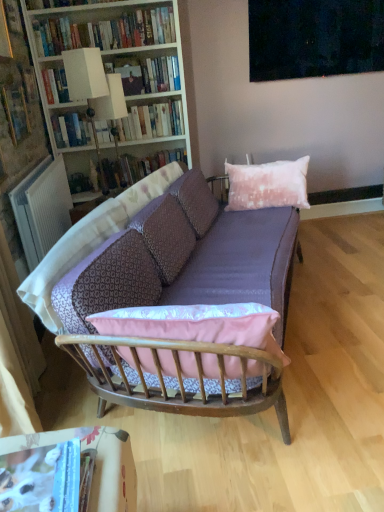
The height and width of the screenshot is (512, 384). I want to click on dark matte painting at upper center, so click(x=314, y=38).

Image resolution: width=384 pixels, height=512 pixels. What do you see at coordinates (94, 92) in the screenshot? I see `white fabric lampshade at upper left, arranged as the 1th lamp when viewed from the front` at bounding box center [94, 92].

This screenshot has width=384, height=512. Describe the element at coordinates (161, 74) in the screenshot. I see `hardcover book at upper center, the 2th book in the top-to-bottom sequence` at that location.

I want to click on white wood bookcase at upper left, so (107, 76).

In order to click on hardcover books at upper left, the third book from the top in this screenshot , I will do `click(146, 122)`.

Relative to white fabric lampshade at upper left, arranged as the 1th lamp when viewed from the front, is hardcover books at upper left, the third book from the top, in front or behind?

hardcover books at upper left, the third book from the top, is positioned farther from the viewer than white fabric lampshade at upper left, arranged as the 1th lamp when viewed from the front.

From the image's perspective, would you say hardcover books at upper left, the fourth book ordered from the bottom, is shown under white fabric lampshade at upper left, arranged as the 1th lamp when viewed from the front?

Actually, hardcover books at upper left, the fourth book ordered from the bottom, appears above white fabric lampshade at upper left, arranged as the 1th lamp when viewed from the front, in the image.

Is hardcover books at upper left, the third book from the top, oriented towards white fabric lampshade at upper left, the second lamp when ordered from back to front?

Yes, hardcover books at upper left, the third book from the top, is facing white fabric lampshade at upper left, the second lamp when ordered from back to front.

Which of these two, hardcover books at upper left, which ranks as the fifth book in front-to-back order, or white fabric lampshade at upper left, the second lamp when ordered from back to front, is smaller?

white fabric lampshade at upper left, the second lamp when ordered from back to front.

Can you confirm if white fabric lampshade at upper left, which is the 1th lamp from back to front, is taller than dark matte painting at upper center?

Indeed, white fabric lampshade at upper left, which is the 1th lamp from back to front, has a greater height compared to dark matte painting at upper center.

Are white fabric lampshade at upper left, which is the 1th lamp from back to front, and dark matte painting at upper center making contact?

No, white fabric lampshade at upper left, which is the 1th lamp from back to front, is not in contact with dark matte painting at upper center.

Is white fabric lampshade at upper left, which is the 1th lamp from back to front, at the right side of dark matte painting at upper center?

No, white fabric lampshade at upper left, which is the 1th lamp from back to front, is not to the right of dark matte painting at upper center.

Does white fabric lampshade at upper left, which is the 1th lamp from back to front, have a larger size compared to dark matte painting at upper center?

No.

Is hardcover books at upper left, arranged as the 6th book when ordered from the bottom, beside white fabric lampshade at upper left, the second lamp when ordered from back to front?

No.

Which of these two, hardcover books at upper left, arranged as the 4th book when viewed from the back, or white fabric lampshade at upper left, arranged as the 1th lamp when viewed from the front, is bigger?

hardcover books at upper left, arranged as the 4th book when viewed from the back.

Considering the sizes of objects hardcover books at upper left, arranged as the 6th book when ordered from the bottom, and white fabric lampshade at upper left, arranged as the 1th lamp when viewed from the front, in the image provided, who is shorter, hardcover books at upper left, arranged as the 6th book when ordered from the bottom, or white fabric lampshade at upper left, arranged as the 1th lamp when viewed from the front,?

Standing shorter between the two is hardcover books at upper left, arranged as the 6th book when ordered from the bottom.

From a real-world perspective, is hardcover books at upper left, arranged as the third book when viewed from the front, positioned above or below white fabric lampshade at upper left, arranged as the 1th lamp when viewed from the front?

hardcover books at upper left, arranged as the third book when viewed from the front, is above white fabric lampshade at upper left, arranged as the 1th lamp when viewed from the front.

Is purple fabric couch at center oriented away from white paper book at lower left, acting as the 1th book starting from the bottom?

No, white paper book at lower left, acting as the 1th book starting from the bottom, is not at the back of purple fabric couch at center.

Which object is closer to the camera taking this photo, purple fabric couch at center or white paper book at lower left, acting as the 1th book starting from the bottom?

white paper book at lower left, acting as the 1th book starting from the bottom, is in front.

Would you say purple fabric couch at center is to the left or to the right of white paper book at lower left, acting as the 1th book starting from the bottom, in the picture?

purple fabric couch at center is to the right of white paper book at lower left, acting as the 1th book starting from the bottom.

From the image's perspective, which one is positioned lower, purple fabric couch at center or white paper book at lower left, the 1th book from the front?

white paper book at lower left, the 1th book from the front, is shown below in the image.

Can you confirm if purple fabric couch at center is wider than hardcover book at center, the sixth book positioned from the front?

Yes.

Is purple fabric couch at center positioned beyond the bounds of hardcover book at center, which is the second book in bottom-to-top order?

Yes, purple fabric couch at center is outside of hardcover book at center, which is the second book in bottom-to-top order.

Between purple fabric couch at center and hardcover book at center, positioned as the fifth book in top-to-bottom order, which one has more height?

purple fabric couch at center is taller.

From the image's perspective, is dark matte painting at upper center positioned above or below hardcover book at upper left, acting as the fifth book starting from the back?

dark matte painting at upper center is situated higher than hardcover book at upper left, acting as the fifth book starting from the back, in the image.

Based on the photo, considering their positions, is dark matte painting at upper center located in front of or behind hardcover book at upper left, which ranks as the third book in bottom-to-top order?

dark matte painting at upper center is behind hardcover book at upper left, which ranks as the third book in bottom-to-top order.

Is dark matte painting at upper center taller than hardcover book at upper left, the second book when ordered from front to back?

Correct, dark matte painting at upper center is much taller as hardcover book at upper left, the second book when ordered from front to back.

From the image's perspective, between white paper book at lower left, acting as the 6th book starting from the top, and dark matte painting at upper center, which one is located above?

dark matte painting at upper center.

From a real-world perspective, is white paper book at lower left, the 1th book from the front, over dark matte painting at upper center?

No.

Between white paper book at lower left, the 1th book from the front, and dark matte painting at upper center, which one is positioned behind?

dark matte painting at upper center is more distant.

Is white paper book at lower left, acting as the 1th book starting from the bottom, spatially inside dark matte painting at upper center, or outside of it?

white paper book at lower left, acting as the 1th book starting from the bottom, cannot be found inside dark matte painting at upper center.

Where is `lamp that is the 1st object to the right of the hardcover books at upper left, the 2th book from the back, starting at the anchor`? Image resolution: width=384 pixels, height=512 pixels. lamp that is the 1st object to the right of the hardcover books at upper left, the 2th book from the back, starting at the anchor is located at coordinates (94, 92).

Where is `the 1st lamp to the left when counting from the dark matte painting at upper center`? The image size is (384, 512). the 1st lamp to the left when counting from the dark matte painting at upper center is located at coordinates (106, 114).

Which object lies further to the anchor point white wood bookcase at upper left, purple fabric couch at center or white fabric lampshade at upper left, the second lamp positioned from the front?

purple fabric couch at center is positioned further to the anchor white wood bookcase at upper left.

From the image, which object appears to be nearer to hardcover books at upper left, which ranks as the fifth book in front-to-back order, hardcover book at upper left, which ranks as the third book in bottom-to-top order, or white fabric lampshade at upper left, the second lamp when ordered from back to front?

white fabric lampshade at upper left, the second lamp when ordered from back to front, lies closer to hardcover books at upper left, which ranks as the fifth book in front-to-back order, than the other object.

In the scene shown: From the image, which object appears to be nearer to white wood bookcase at upper left, purple fabric couch at center or hardcover book at center, which is the second book in bottom-to-top order?

hardcover book at center, which is the second book in bottom-to-top order, lies closer to white wood bookcase at upper left than the other object.

Which object lies nearer to the anchor point pink cotton pillow at upper right, white fabric lampshade at upper left, arranged as the 1th lamp when viewed from the front, or white plastic radiator at left?

white fabric lampshade at upper left, arranged as the 1th lamp when viewed from the front, is positioned closer to the anchor pink cotton pillow at upper right.

From the image, which object appears to be nearer to dark matte painting at upper center, hardcover books at upper left, arranged as the 4th book when viewed from the back, or white fabric lampshade at upper left, the second lamp when ordered from back to front?

hardcover books at upper left, arranged as the 4th book when viewed from the back, is positioned closer to the anchor dark matte painting at upper center.

Which object lies nearer to the anchor point purple fabric couch at center, hardcover books at upper left, arranged as the 6th book when ordered from the bottom, or white fabric lampshade at upper left, the second lamp positioned from the front?

white fabric lampshade at upper left, the second lamp positioned from the front, is closer to purple fabric couch at center.

Based on their spatial positions, is pink cotton pillow at upper right or purple fabric couch at center closer to hardcover books at upper left, the third book from the top?

pink cotton pillow at upper right is positioned closer to the anchor hardcover books at upper left, the third book from the top.

From the image, which object appears to be nearer to white paper book at lower left, acting as the 1th book starting from the bottom, purple fabric couch at center or white fabric lampshade at upper left, arranged as the 1th lamp when viewed from the front?

purple fabric couch at center.

Locate an element on the screen. This screenshot has height=512, width=384. lamp between purple fabric couch at center and white fabric lampshade at upper left, which is the 1th lamp from back to front, from front to back is located at coordinates (94, 92).

Locate an element on the screen. radiator located between white paper book at lower left, acting as the 1th book starting from the bottom, and hardcover book at upper center, placed as the fourth book when sorted from front to back, in the depth direction is located at coordinates (42, 208).

Identify the location of book positioned between purple fabric couch at center and hardcover books at upper left, which appears as the first book when viewed from the top, from near to far. This screenshot has width=384, height=512. (15, 102).

The height and width of the screenshot is (512, 384). I want to click on television located between white paper book at lower left, acting as the sixth book starting from the back, and hardcover book at center, which appears as the 1th book when viewed from the back, in the depth direction, so click(314, 38).